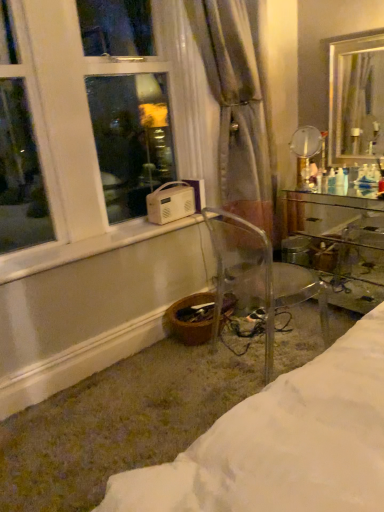
Locate an element on the screen. The image size is (384, 512). vacant area situated below white plastic window at lower left (from a real-world perspective) is located at coordinates (106, 238).